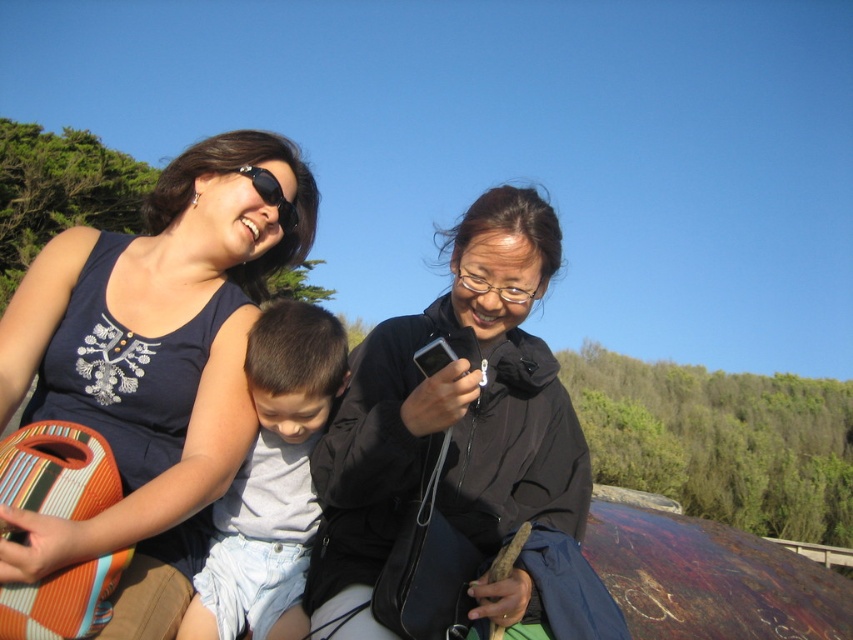
Question: Among these points, which one is farthest from the camera?

Choices:
 (A) (352, 632)
 (B) (276, 332)
 (C) (279, 170)
 (D) (242, 170)

Answer: (C)

Question: Can you confirm if black matte jacket at center is positioned below light blue denim shorts at center?

Choices:
 (A) no
 (B) yes

Answer: (A)

Question: Estimate the real-world distances between objects in this image. Which object is farther from the black matte jacket at center?

Choices:
 (A) light blue denim shorts at center
 (B) black matte sunglasses at upper center

Answer: (B)

Question: Among these objects, which one is nearest to the camera?

Choices:
 (A) light blue denim shorts at center
 (B) black matte sunglasses at upper center

Answer: (A)

Question: Is light blue denim shorts at center smaller than black matte sunglasses at upper center?

Choices:
 (A) no
 (B) yes

Answer: (A)

Question: Can you confirm if light blue denim shorts at center is thinner than black matte sunglasses at upper center?

Choices:
 (A) yes
 (B) no

Answer: (B)